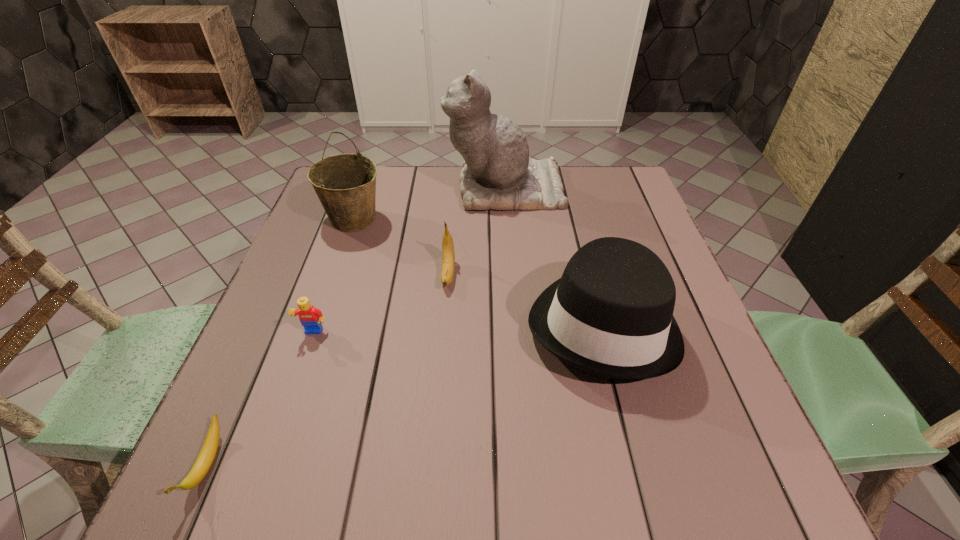
Find the location of `free space that satisfies the following two spatial constraints: 1. on the front-facing side of the cat; 2. at the start of the peel on the third shortest object`. free space that satisfies the following two spatial constraints: 1. on the front-facing side of the cat; 2. at the start of the peel on the third shortest object is located at coordinates (511, 274).

This screenshot has height=540, width=960. In order to click on free space that satisfies the following two spatial constraints: 1. on the front-facing side of the tallest object; 2. on the front side of the wine bucket in this screenshot , I will do `click(507, 219)`.